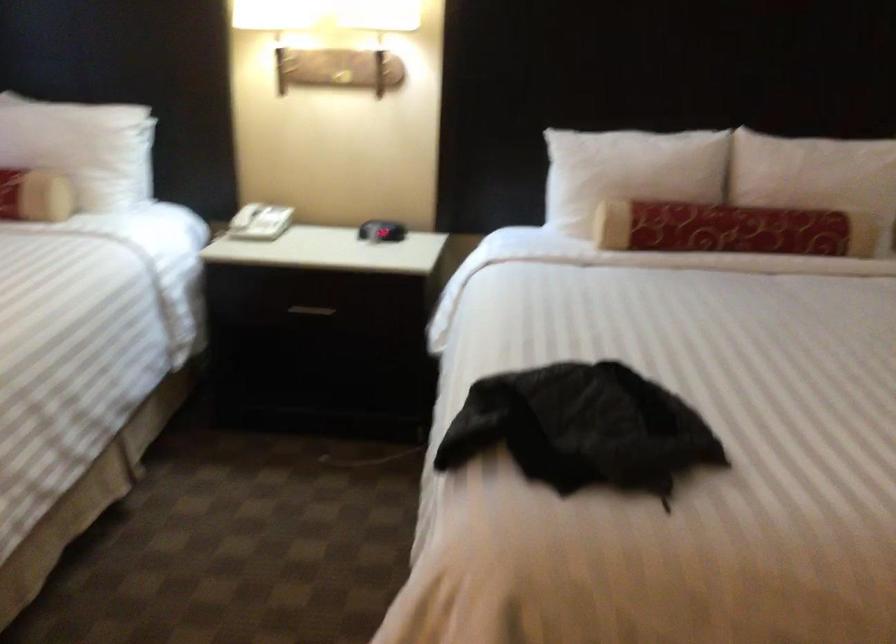
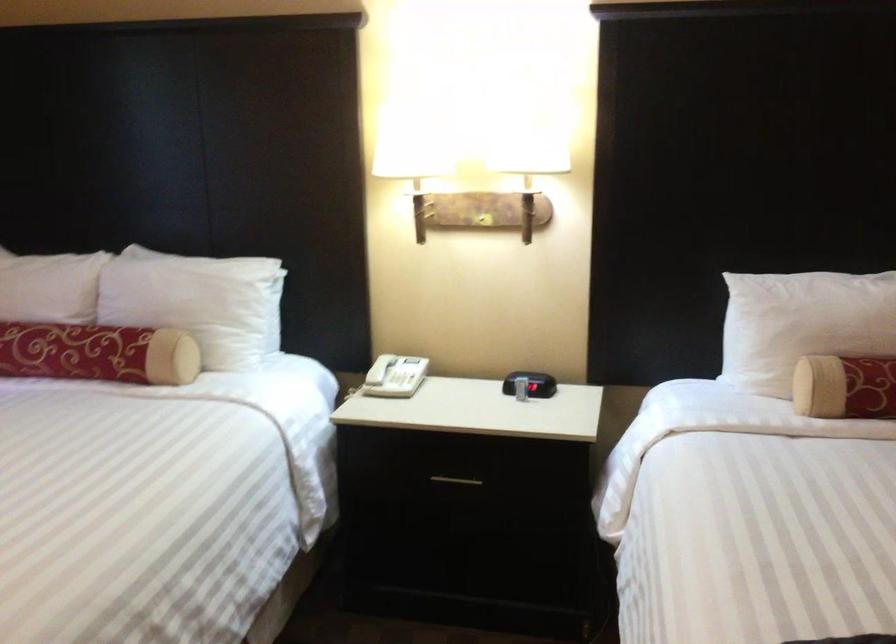
The point at (312, 308) is marked in the first image. Where is the corresponding point in the second image?

(455, 480)